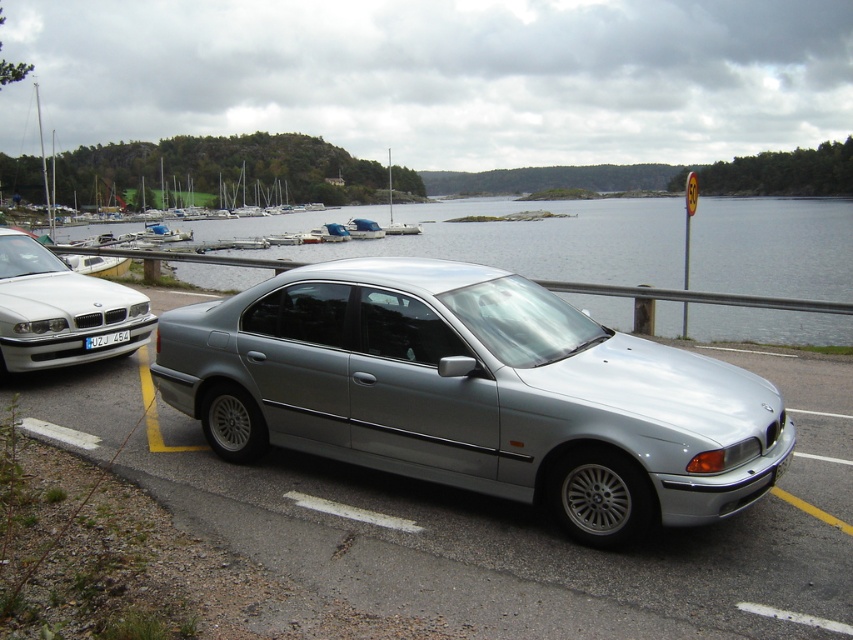
You are a photographer planning to capture a shot of the satin silver car at center and the silver metallic water at center. Based on their sizes in the image, which object should appear smaller in the final photo?

The satin silver car at center appears smaller in the photo because it has a lesser height compared to the silver metallic water at center.

You are a photographer standing at the lakeside and want to capture both the silver metallic water at center and the white plastic license plate at center in a single shot. Which object should you focus on first to ensure both are in frame?

You should focus on the white plastic license plate at center first because the silver metallic water at center is located above it, so adjusting the camera to include the lower object ensures the upper one is also captured.

What is the color of the car located at the coordinates point (474, 394)?

The point (474, 394) marks the satin silver car at center, so the car is satin silver in color.